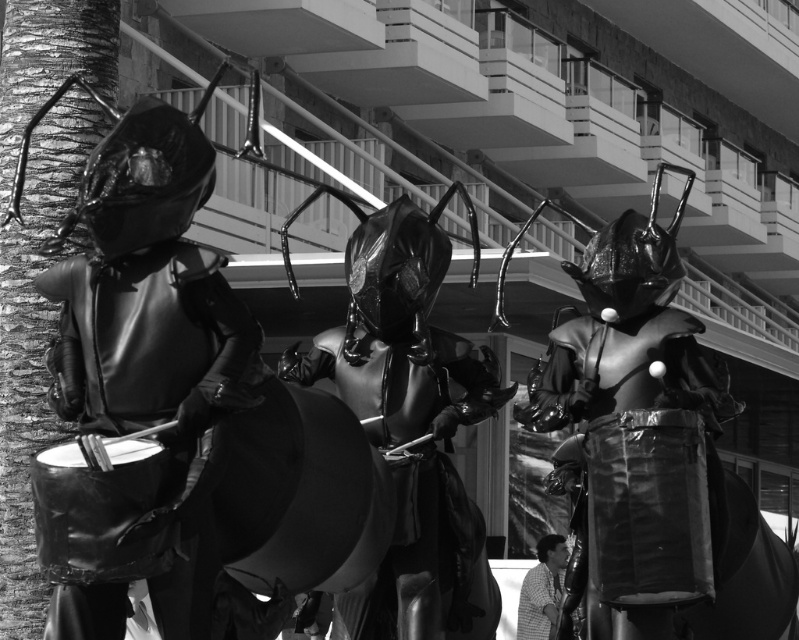
What is located at the coordinates point (635, 433) in the image?

The glossy metallic ant at center is located at point (635, 433).

You are standing at a point 21.48 meters away from the point marked at coordinates (x=489, y=362) in the image. If you want to move closer to that point, which direction should you walk relative to the scene?

Since the point marked at coordinates (x=489, y=362) is 21.48 meters away from your current position, you should walk towards the point to reduce the distance between you and the marked coordinates.